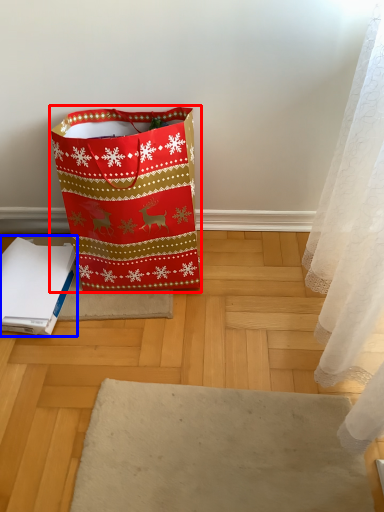
Question: Which object is closer to the camera taking this photo, luggage and bags (highlighted by a red box) or notebook (highlighted by a blue box)?

Choices:
 (A) luggage and bags
 (B) notebook

Answer: (A)